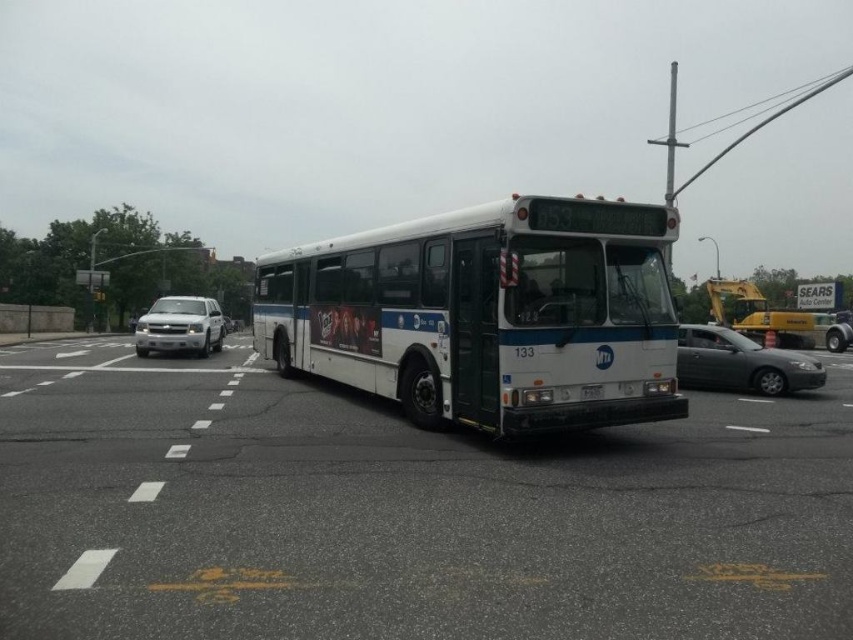
You are a pedestrian standing at the crosswalk in front of the bus. You need to cross the street and want to know which vehicle is taller between the satin silver sedan at right and the silver metallic truck at left. Which one is taller?

The silver metallic truck at left is taller than the satin silver sedan at right.

You are a city planner analyzing traffic flow. You observe the satin silver sedan at right and the white plastic license plate at center in the scene. Which object occupies more horizontal space in the image?

The satin silver sedan at right has a larger width than the white plastic license plate at center, so it occupies more horizontal space in the image.

You are driving a delivery van that is 6 meters long. You need to pass between the white metallic bus at center and the satin silver sedan at right. Is there enough space for your van to fit through the gap between them?

The gap between the white metallic bus at center and the satin silver sedan at right is 5.94 meters. Since your van is 6 meters long, it is slightly too long to fit through the gap. You should look for another route or wait for the vehicles to move to create more space.